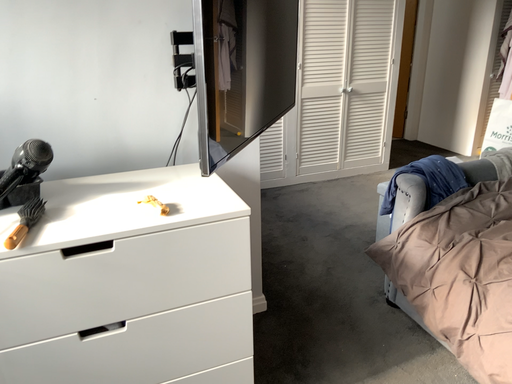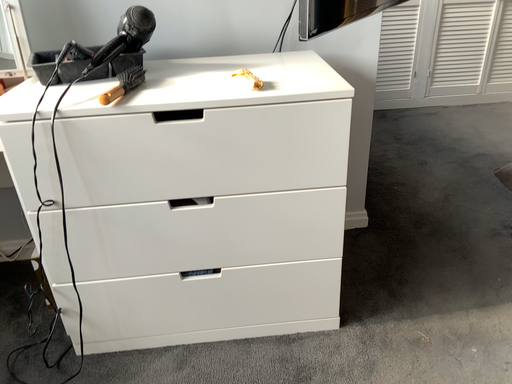
Question: Which way did the camera rotate in the video?

Choices:
 (A) rotated downward
 (B) rotated upward

Answer: (A)